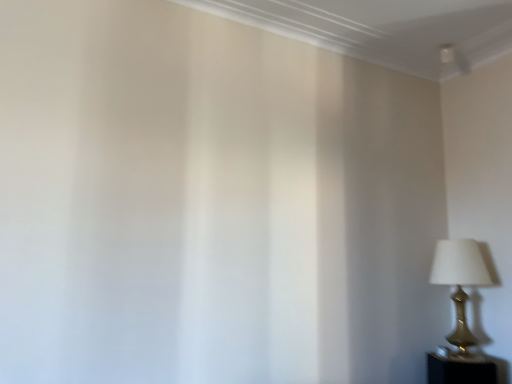
The height and width of the screenshot is (384, 512). I want to click on gold metallic lamp at right, so click(x=459, y=291).

What is the approximate width of gold metallic lamp at right?

gold metallic lamp at right is 31.36 centimeters in width.

Describe the element at coordinates (459, 291) in the screenshot. I see `gold metallic lamp at right` at that location.

The width and height of the screenshot is (512, 384). Find the location of `gold metallic lamp at right`. gold metallic lamp at right is located at coordinates (459, 291).